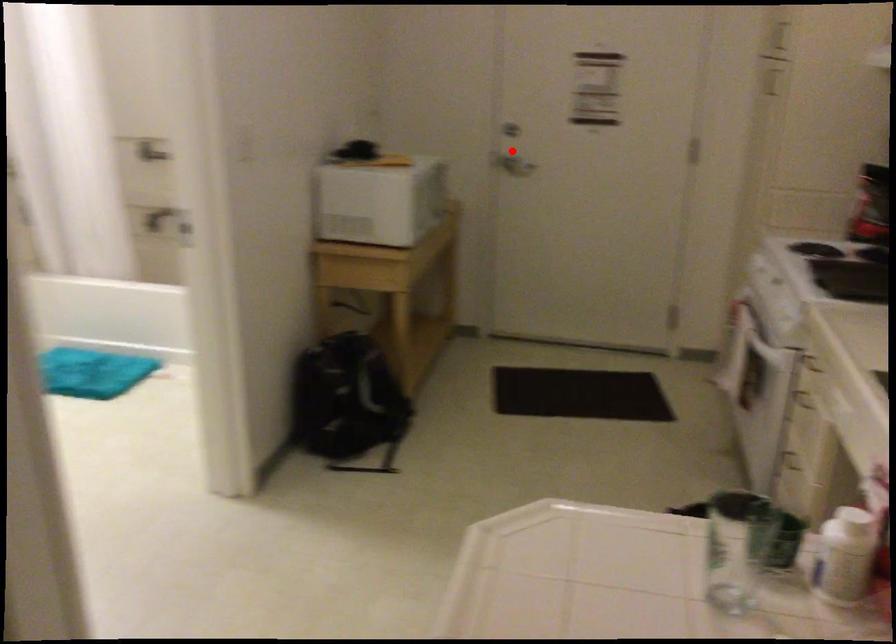
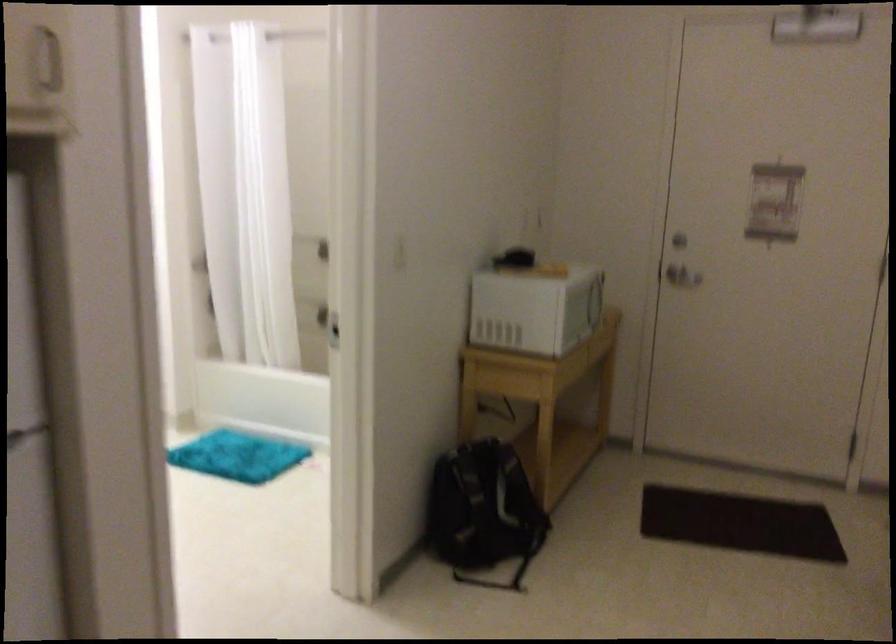
The point at the highlighted location is marked in the first image. Where is the corresponding point in the second image?

(679, 265)